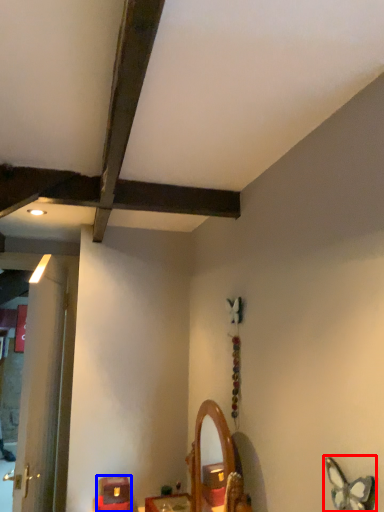
Question: Which object appears closest to the camera in this image, butterfly (highlighted by a red box) or furniture (highlighted by a blue box)?

Choices:
 (A) butterfly
 (B) furniture

Answer: (A)